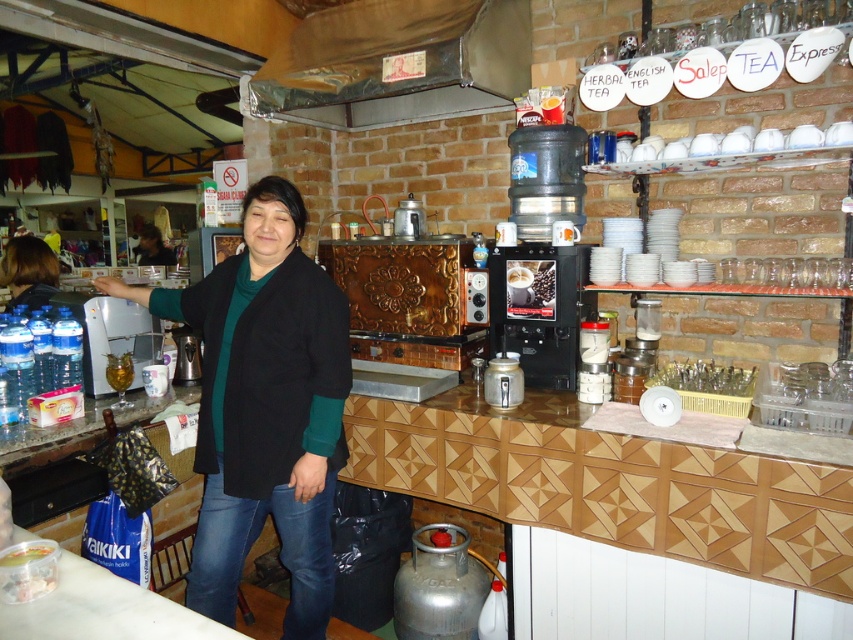
Can you confirm if blonde hair at upper left is taller than translucent plastic bag at lower left?

Yes.

Does blonde hair at upper left appear on the right side of translucent plastic bag at lower left?

Incorrect, blonde hair at upper left is not on the right side of translucent plastic bag at lower left.

Is point (16, 248) in front of point (10, 596)?

No, it is behind (10, 596).

Locate an element on the screen. blonde hair at upper left is located at coordinates (28, 272).

Describe the element at coordinates (264, 406) in the screenshot. I see `dark green fabric jacket at center` at that location.

Is dark green fabric jacket at center behind translucent plastic bag at lower left?

Yes.

Is point (280, 269) positioned before point (9, 582)?

No, it is not.

Find the location of a particular element. The image size is (853, 640). dark green fabric jacket at center is located at coordinates (264, 406).

Is point (323, 108) positioned before point (20, 598)?

No, it is behind (20, 598).

Can you confirm if silver metallic exhaust hood at upper center is positioned below translucent plastic bag at lower left?

No.

Between point (418, 104) and point (4, 563), which one is positioned in front?

Point (4, 563) is more forward.

Locate an element on the screen. silver metallic exhaust hood at upper center is located at coordinates (397, 61).